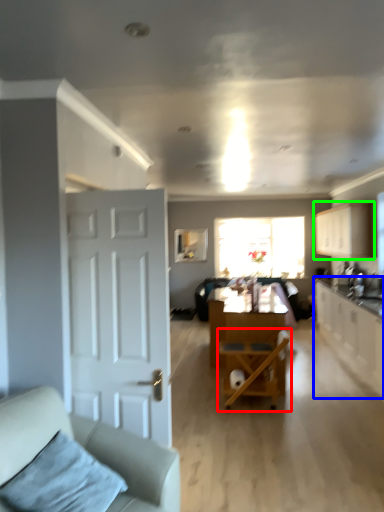
Question: Which is nearer to the chair (highlighted by a red box)? cabinetry (highlighted by a blue box) or cabinetry (highlighted by a green box).

Choices:
 (A) cabinetry
 (B) cabinetry

Answer: (A)